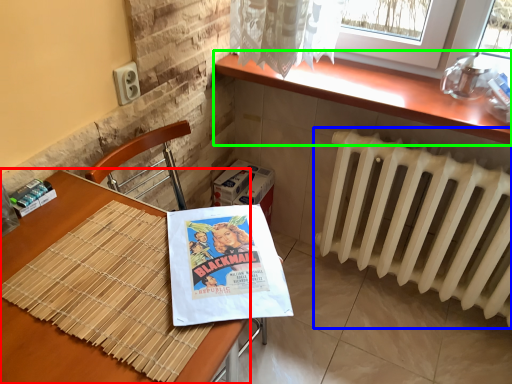
Question: Estimate the real-world distances between objects in this image. Which object is farther from table (highlighted by a red box), radiator (highlighted by a blue box) or counter top (highlighted by a green box)?

Choices:
 (A) radiator
 (B) counter top

Answer: (A)